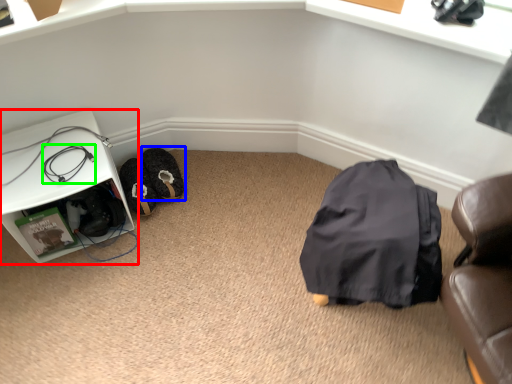
Question: Which is farther away from furniture (highlighted by a red box)? footwear (highlighted by a blue box) or wire (highlighted by a green box)?

Choices:
 (A) footwear
 (B) wire

Answer: (A)